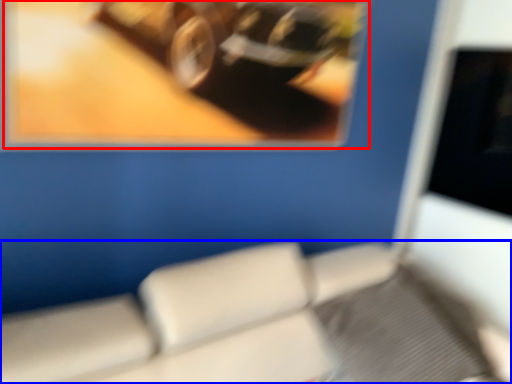
Question: Which object is closer to the camera taking this photo, picture frame (highlighted by a red box) or furniture (highlighted by a blue box)?

Choices:
 (A) picture frame
 (B) furniture

Answer: (B)